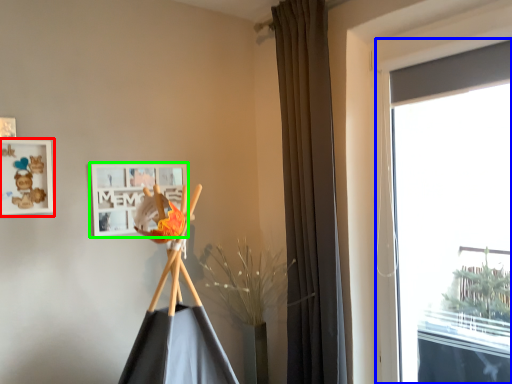
Question: Estimate the real-world distances between objects in this image. Which object is closer to picture frame (highlighted by a red box), window (highlighted by a blue box) or picture frame (highlighted by a green box)?

Choices:
 (A) window
 (B) picture frame

Answer: (B)